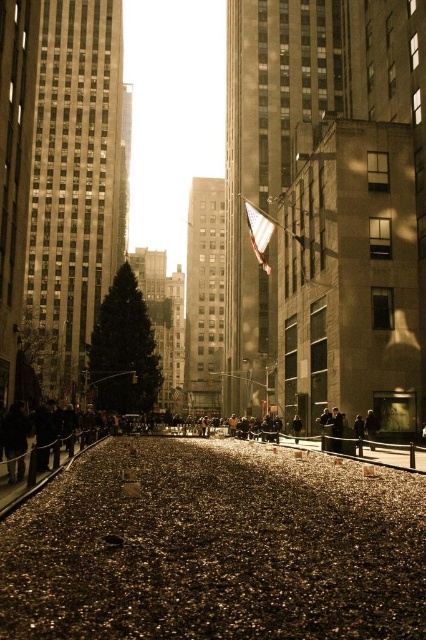
Question: Which of the following is the farthest from the observer?

Choices:
 (A) (370, 422)
 (B) (354, 432)

Answer: (A)

Question: Can you confirm if dark brown leather jacket at center is positioned to the right of dark brown leather coat at center?

Choices:
 (A) yes
 (B) no

Answer: (A)

Question: Among these objects, which one is nearest to the camera?

Choices:
 (A) dark gray jacket at center
 (B) dark brown leather coat at center
 (C) dark brown leather jacket at center

Answer: (A)

Question: Where is dark brown leather jacket at center located in relation to dark gray jacket at center in the image?

Choices:
 (A) right
 (B) left

Answer: (A)

Question: Can you confirm if dark brown leather jacket at center is wider than dark brown leather coat at center?

Choices:
 (A) no
 (B) yes

Answer: (A)

Question: Which object is closer to the camera taking this photo?

Choices:
 (A) dark brown leather coat at center
 (B) dark brown leather jacket at center

Answer: (B)